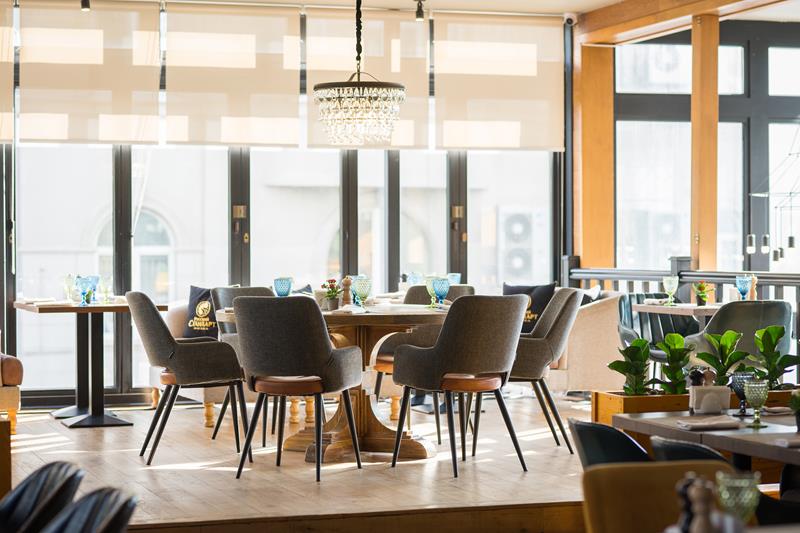
Locate an element on the screen. This screenshot has width=800, height=533. hanging objects is located at coordinates pos(789,239), pos(784,249), pos(778,253), pos(766,244), pos(752,246).